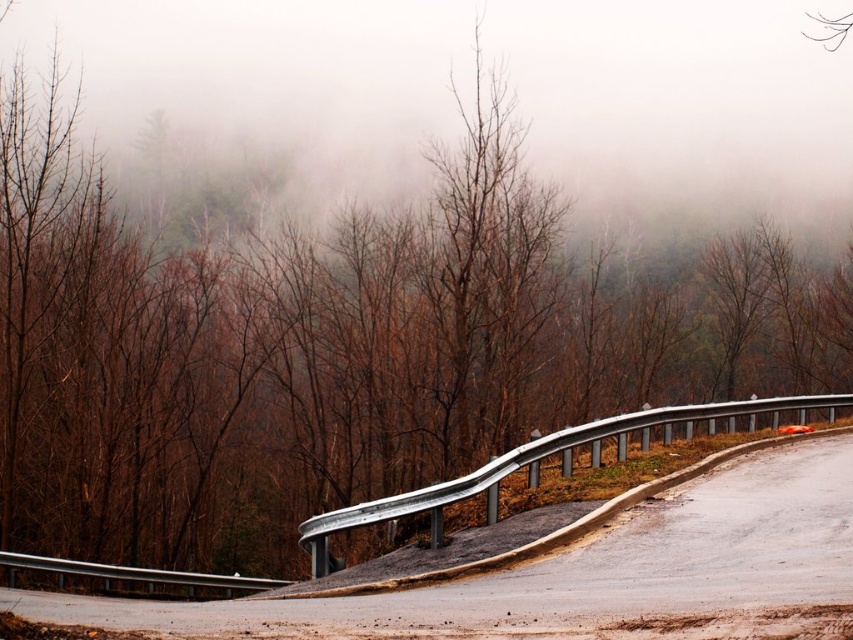
Question: From the image, what is the correct spatial relationship of silver metallic guardrail at center in relation to silver metallic guardrail at lower left?

Choices:
 (A) above
 (B) below

Answer: (A)

Question: Does silver metallic guardrail at center come in front of silver metallic guardrail at lower left?

Choices:
 (A) yes
 (B) no

Answer: (A)

Question: Is silver metallic guardrail at center further to camera compared to silver metallic guardrail at lower left?

Choices:
 (A) no
 (B) yes

Answer: (A)

Question: Which of the following is the closest to the observer?

Choices:
 (A) (137, 577)
 (B) (715, 406)

Answer: (B)

Question: Among these points, which one is nearest to the camera?

Choices:
 (A) (91, 576)
 (B) (718, 410)

Answer: (A)

Question: Which point is closer to the camera?

Choices:
 (A) (363, 524)
 (B) (22, 561)

Answer: (A)